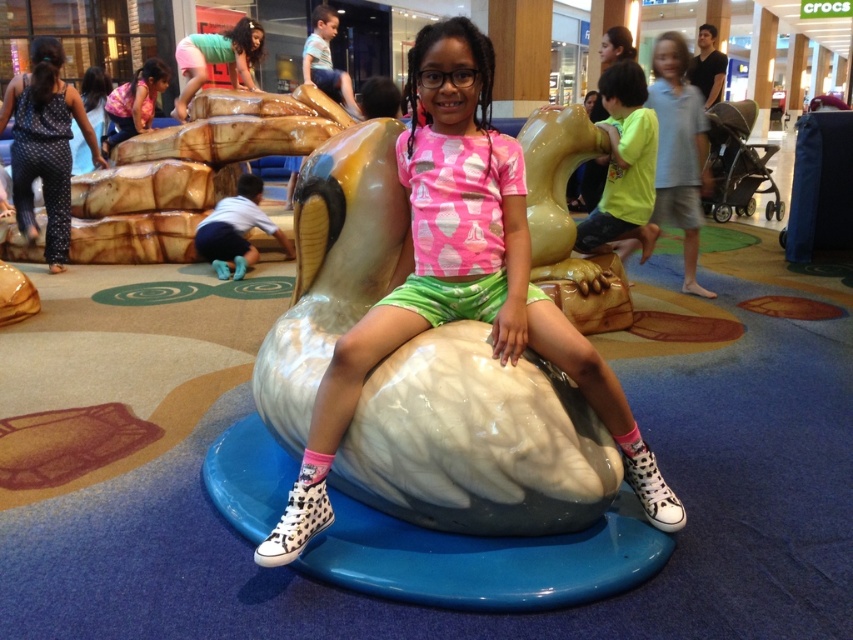
Question: Which point is closer to the camera?

Choices:
 (A) (589, 356)
 (B) (242, 205)
 (C) (113, 96)

Answer: (A)

Question: Is white glossy dolphin at center further to camera compared to green textured shirt at upper right?

Choices:
 (A) no
 (B) yes

Answer: (A)

Question: Which of these objects is positioned closest to the blue rubber gloves at lower center?

Choices:
 (A) white glossy dolphin at center
 (B) green textured shirt at upper right
 (C) matte pink shirt at upper center

Answer: (C)

Question: Does white glossy dolphin at center come behind matte pink shirt at upper center?

Choices:
 (A) no
 (B) yes

Answer: (A)

Question: Which object is farther from the camera taking this photo?

Choices:
 (A) white glossy dolphin at center
 (B) blue rubber gloves at lower center
 (C) green textured shirt at upper right
 (D) matte pink shirt at upper center

Answer: (D)

Question: Does green textured shirt at upper right appear on the right side of blue rubber gloves at lower center?

Choices:
 (A) yes
 (B) no

Answer: (A)